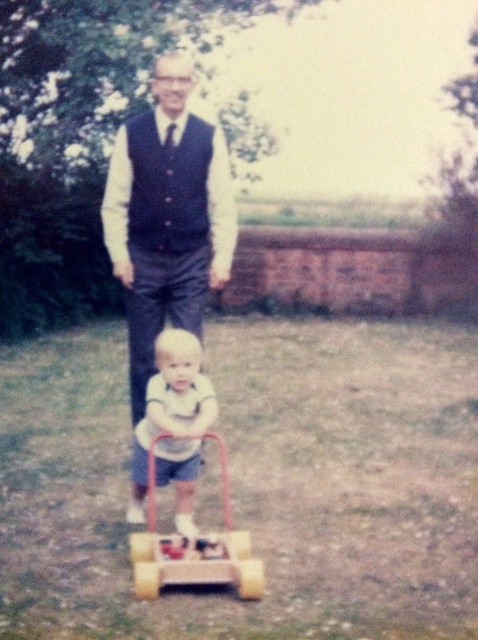
Question: Observing the image, what is the correct spatial positioning of dark blue textured vest at center in reference to yellow rubber toy at center?

Choices:
 (A) below
 (B) above

Answer: (B)

Question: Can you confirm if dark blue textured vest at center is positioned to the right of yellow rubber toy at center?

Choices:
 (A) no
 (B) yes

Answer: (A)

Question: Which point appears farthest from the camera in this image?

Choices:
 (A) (144, 460)
 (B) (141, 225)

Answer: (B)

Question: Considering the real-world distances, which object is farthest from the yellow rubber toy at center?

Choices:
 (A) smooth white shirt at center
 (B) dark blue fabric vest at center

Answer: (B)

Question: Is smooth white shirt at center further to camera compared to yellow rubber toy at center?

Choices:
 (A) yes
 (B) no

Answer: (A)

Question: Which point is farther to the camera?

Choices:
 (A) smooth white shirt at center
 (B) dark blue fabric vest at center
 (C) dark blue textured vest at center
 (D) yellow rubber toy at center

Answer: (B)